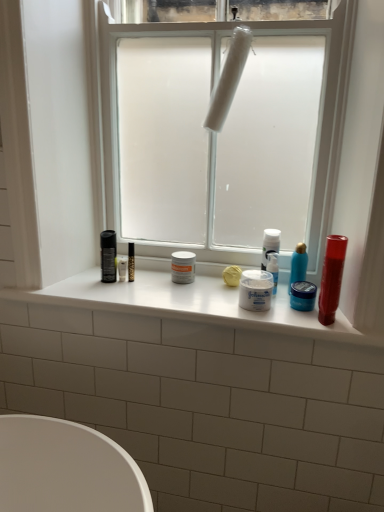
Question: Considering the positions of point (299, 302) and point (180, 265), is point (299, 302) closer or farther from the camera than point (180, 265)?

Choices:
 (A) farther
 (B) closer

Answer: (B)

Question: From a real-world perspective, is blue matte jar at center, which is the third toiletry in left-to-right order, above or below white matte jar at center, placed as the 4th toiletry when sorted from right to left?

Choices:
 (A) below
 (B) above

Answer: (A)

Question: Which of these objects is positioned farthest from the white matte jar at center, which appears as the 2th toiletry when viewed from the left?

Choices:
 (A) blue matte jar at center, the second toiletry when ordered from right to left
 (B) white matte jar at center, placed as the 4th toiletry when sorted from right to left
 (C) blue glossy bottle at center right, the first toiletry positioned from the right
 (D) white glossy window sill at center
 (E) shiny red tube at right

Answer: (B)

Question: Which of these objects is positioned closest to the blue glossy bottle at center right, which ranks as the fourth toiletry in left-to-right order?

Choices:
 (A) white matte plastic at center
 (B) white matte jar at center, positioned as the first toiletry in left-to-right order
 (C) white glossy window sill at center
 (D) white matte jar at center, which appears as the 2th toiletry when viewed from the left
 (E) shiny red tube at right

Answer: (D)